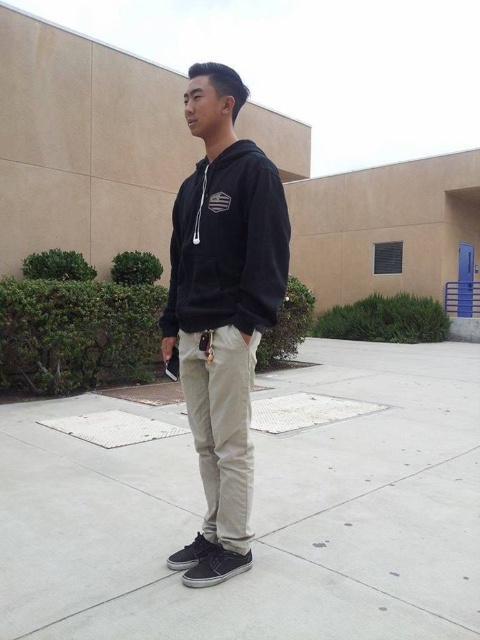
Question: Does concrete at center lie behind black cotton hoodie at center?

Choices:
 (A) no
 (B) yes

Answer: (B)

Question: Which of these objects is positioned farthest from the black cotton hoodie at center?

Choices:
 (A) black fleece sweatshirt at center
 (B) concrete at center

Answer: (B)

Question: Does concrete at center appear over black fleece sweatshirt at center?

Choices:
 (A) no
 (B) yes

Answer: (A)

Question: Which object appears closest to the camera in this image?

Choices:
 (A) black cotton hoodie at center
 (B) black fleece sweatshirt at center

Answer: (B)

Question: Is concrete at center further to camera compared to black fleece sweatshirt at center?

Choices:
 (A) no
 (B) yes

Answer: (B)

Question: Based on their relative distances, which object is farther from the black fleece sweatshirt at center?

Choices:
 (A) concrete at center
 (B) black cotton hoodie at center

Answer: (A)